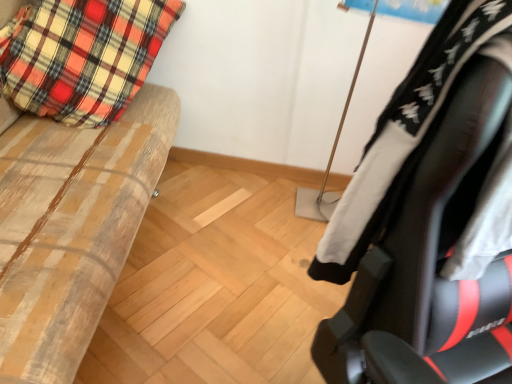
You are a GUI agent. You are given a task and a screenshot of the screen. Output one action in this format:
    pyautogui.click(x=<x>, y=<y>)
    Task: Click on the plaid fabric pillow at left
    This screenshot has height=384, width=512.
    Given the screenshot: What is the action you would take?
    [83, 56]

What are the coordinates of `black leather chair at right` in the screenshot? It's located at (426, 219).

Image resolution: width=512 pixels, height=384 pixels. I want to click on wooden bench at left, so click(70, 226).

Describe the element at coordinates (70, 226) in the screenshot. This screenshot has height=384, width=512. I see `wooden bench at left` at that location.

Locate an element on the screen. The image size is (512, 384). plaid fabric pillow at left is located at coordinates (83, 56).

Considering the relative sizes of black leather chair at right and wooden bench at left in the image provided, is black leather chair at right thinner than wooden bench at left?

Indeed, black leather chair at right has a lesser width compared to wooden bench at left.

From a real-world perspective, between black leather chair at right and wooden bench at left, who is vertically higher?

black leather chair at right.

From the image's perspective, relative to wooden bench at left, is black leather chair at right above or below?

black leather chair at right is situated lower than wooden bench at left in the image.

Does point (430, 297) appear closer or farther from the camera than point (106, 251)?

Point (430, 297).

Would you say plaid fabric pillow at left is outside wooden bench at left?

No.

Is point (140, 5) farther from viewer compared to point (96, 224)?

Yes, it is.

Considering the sizes of plaid fabric pillow at left and wooden bench at left in the image, is plaid fabric pillow at left wider or thinner than wooden bench at left?

Considering their sizes, plaid fabric pillow at left looks slimmer than wooden bench at left.

Considering the sizes of objects plaid fabric pillow at left and wooden bench at left in the image provided, who is bigger, plaid fabric pillow at left or wooden bench at left?

Bigger between the two is wooden bench at left.

Does point (48, 70) appear closer or farther from the camera than point (359, 248)?

Clearly, point (48, 70) is more distant from the camera than point (359, 248).

Are plaid fabric pillow at left and black leather chair at right making contact?

No, plaid fabric pillow at left is not with black leather chair at right.

Would you say black leather chair at right is part of plaid fabric pillow at left's contents?

Actually, black leather chair at right is outside plaid fabric pillow at left.

How different are the orientations of plaid fabric pillow at left and black leather chair at right in degrees?

There is a 5.93-degree angle between the facing directions of plaid fabric pillow at left and black leather chair at right.

Is the position of black leather chair at right more distant than that of plaid fabric pillow at left?

No, black leather chair at right is closer to the viewer.

Based on their positions, is black leather chair at right located to the left or right of plaid fabric pillow at left?

Clearly, black leather chair at right is on the right of plaid fabric pillow at left in the image.

Considering the relative sizes of black leather chair at right and plaid fabric pillow at left in the image provided, is black leather chair at right shorter than plaid fabric pillow at left?

Correct, black leather chair at right is not as tall as plaid fabric pillow at left.

Are black leather chair at right and plaid fabric pillow at left far apart?

black leather chair at right is far away from plaid fabric pillow at left.

Is black leather chair at right completely or partially inside wooden bench at left?

No, black leather chair at right is not surrounded by wooden bench at left.

Is wooden bench at left far from black leather chair at right?

wooden bench at left is actually quite close to black leather chair at right.

Where is `chair in front of the wooden bench at left`? chair in front of the wooden bench at left is located at coordinates (426, 219).

Who is shorter, wooden bench at left or black leather chair at right?

Standing shorter between the two is black leather chair at right.

Is wooden bench at left outside of plaid fabric pillow at left?

Yes, wooden bench at left is not within plaid fabric pillow at left.

Is wooden bench at left taller or shorter than plaid fabric pillow at left?

Clearly, wooden bench at left is taller compared to plaid fabric pillow at left.

From the image's perspective, between wooden bench at left and plaid fabric pillow at left, who is located below?

wooden bench at left, from the image's perspective.

There is a wooden bench at left. What are the coordinates of `chair above it (from a real-world perspective)` in the screenshot? It's located at (426, 219).

The height and width of the screenshot is (384, 512). Find the location of `pillow located on the right of wooden bench at left`. pillow located on the right of wooden bench at left is located at coordinates (83, 56).

From the image, which object appears to be farther from wooden bench at left, plaid fabric pillow at left or black leather chair at right?

black leather chair at right lies further to wooden bench at left than the other object.

Consider the image. Estimate the real-world distances between objects in this image. Which object is further from black leather chair at right, wooden bench at left or plaid fabric pillow at left?

plaid fabric pillow at left.

Estimate the real-world distances between objects in this image. Which object is closer to wooden bench at left, black leather chair at right or plaid fabric pillow at left?

plaid fabric pillow at left is closer to wooden bench at left.

Based on their spatial positions, is black leather chair at right or wooden bench at left closer to plaid fabric pillow at left?

The object closer to plaid fabric pillow at left is wooden bench at left.

Estimate the real-world distances between objects in this image. Which object is further from plaid fabric pillow at left, wooden bench at left or black leather chair at right?

black leather chair at right.

Based on their spatial positions, is plaid fabric pillow at left or wooden bench at left further from black leather chair at right?

Among the two, plaid fabric pillow at left is located further to black leather chair at right.

This screenshot has height=384, width=512. Find the location of `pillow located between wooden bench at left and black leather chair at right in the left-right direction`. pillow located between wooden bench at left and black leather chair at right in the left-right direction is located at coordinates (83, 56).